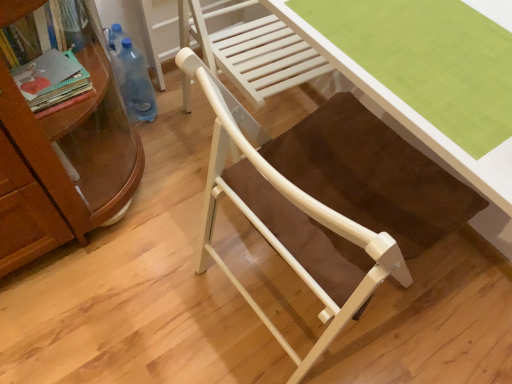
Identify the location of free spot behind blue plastic bottle at left. The width and height of the screenshot is (512, 384). (170, 92).